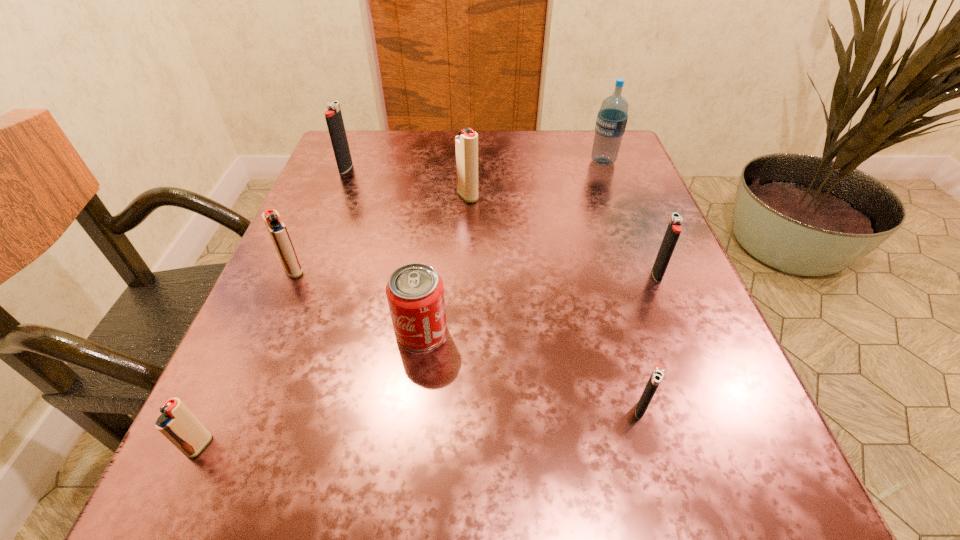
Find the location of a particular element. The width and height of the screenshot is (960, 540). the tallest object is located at coordinates (611, 122).

At what (x,y) coordinates should I click in order to perform the action: click on blue water bottle. Please return your answer as a coordinate pair (x, y). Looking at the image, I should click on (611, 122).

Locate an element on the screen. the fourth igniter from left to right is located at coordinates (466, 143).

Where is `the fourth object from right to left`? the fourth object from right to left is located at coordinates (466, 143).

The width and height of the screenshot is (960, 540). I want to click on the farthest igniter, so click(333, 116).

Locate an element on the screen. the biggest black igniter is located at coordinates (333, 116).

Identify the location of the second nearest black igniter. (674, 228).

Locate an element on the screen. The width and height of the screenshot is (960, 540). the rightmost igniter is located at coordinates (674, 228).

Where is `the second biggest red igniter`? Image resolution: width=960 pixels, height=540 pixels. the second biggest red igniter is located at coordinates (276, 228).

Locate an element on the screen. red can is located at coordinates (415, 293).